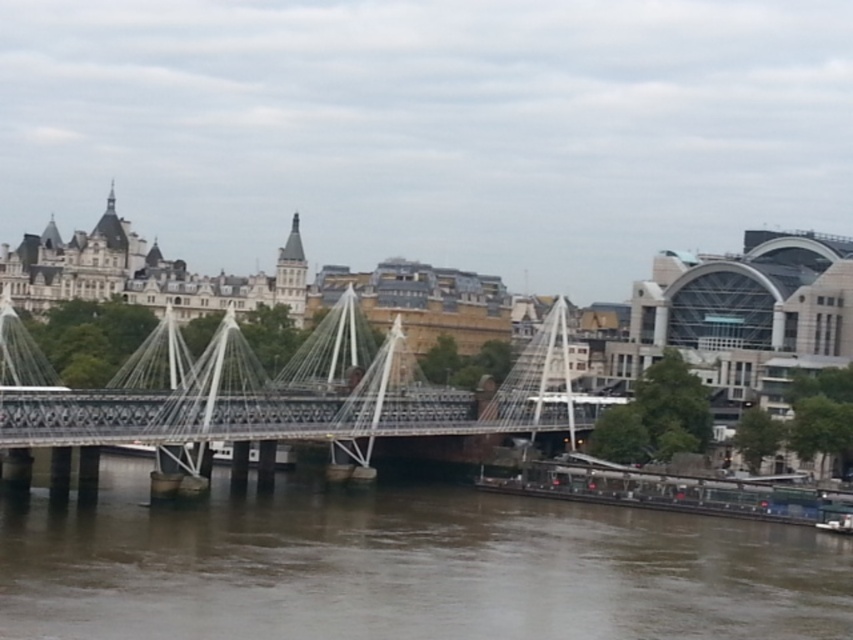
You are a city planner analyzing the image of the cityscape. You need to determine the relative sizes of the brown murky water at center and the metallic silver suspension bridge at center. Which one occupies a larger area in the image?

The metallic silver suspension bridge at center occupies a larger area in the image than the brown murky water at center because the brown murky water at center is smaller than the metallic silver suspension bridge at center.

From the picture: You are standing at the point labeled as point (x=791, y=548) in the cityscape. If you want to walk to the suspension bridge, which direction should you head towards?

Since the point (x=791, y=548) is 85.20 meters away from the viewer, you should head towards the suspension bridge by moving away from your current position towards the bridge.

You are a drone operator tasked with capturing aerial footage of the cityscape. Your drone has a maximum flight range of 15 meters. If you are currently positioned above the brown murky water at center, can you safely fly your drone to the metallic silver suspension bridge at center without exceeding its range?

The brown murky water at center and metallic silver suspension bridge at center are 13.77 meters apart from each other. Since the drone has a maximum flight range of 15 meters, it can safely fly from the brown murky water at center to the metallic silver suspension bridge at center as the distance is within the drone operator range limit.